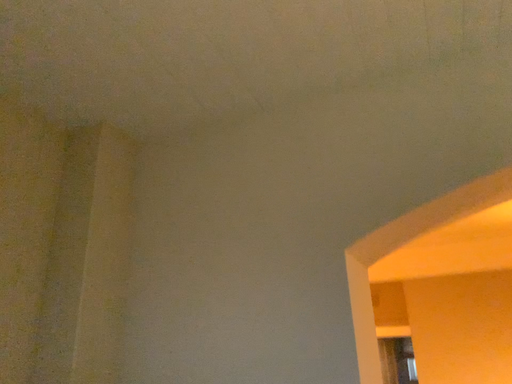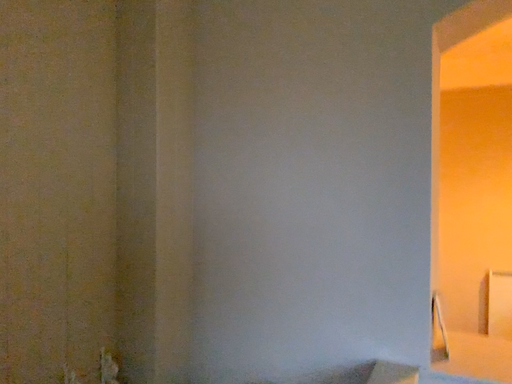
Question: How did the camera likely rotate when shooting the video?

Choices:
 (A) rotated downward
 (B) rotated upward

Answer: (A)